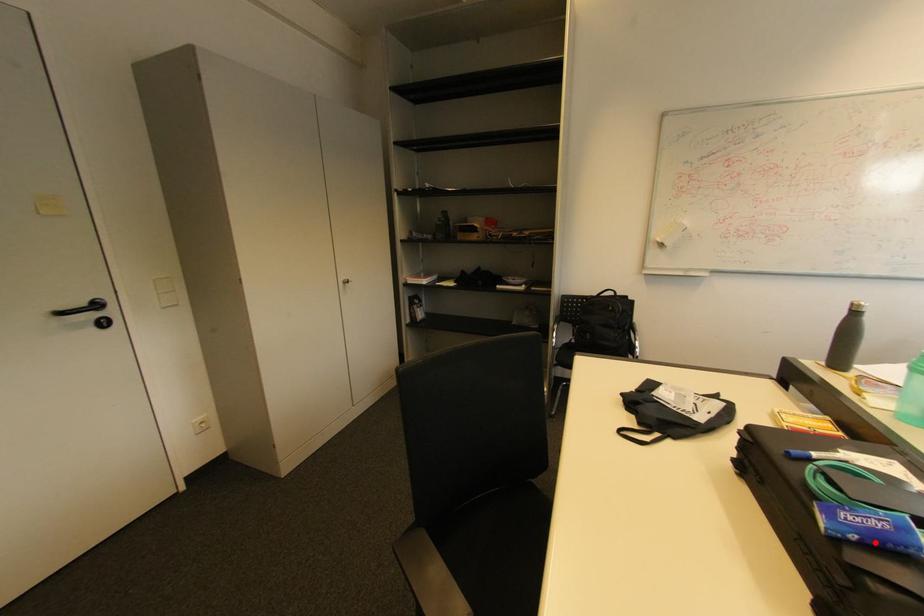
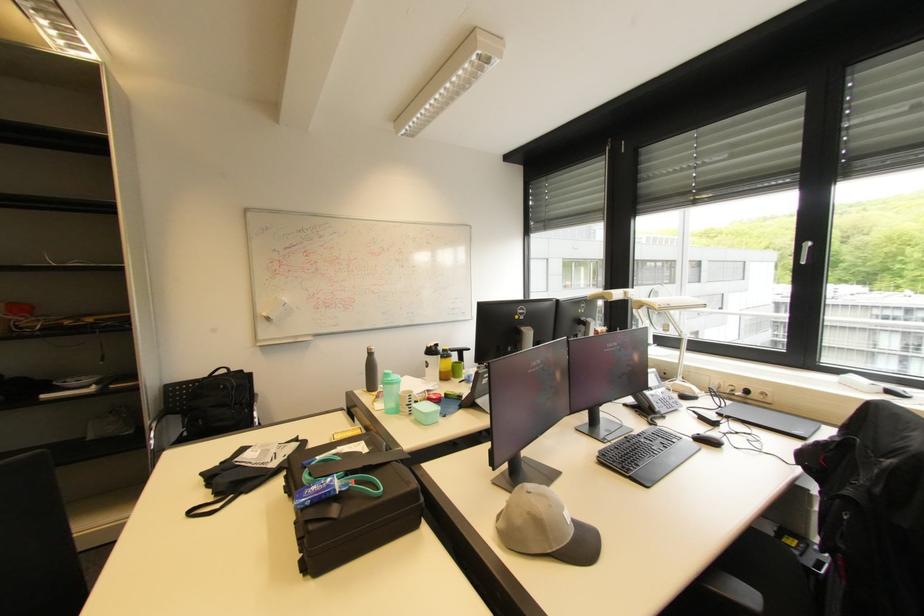
The point at the highlighted location is marked in the first image. Where is the corresponding point in the second image?

(321, 501)